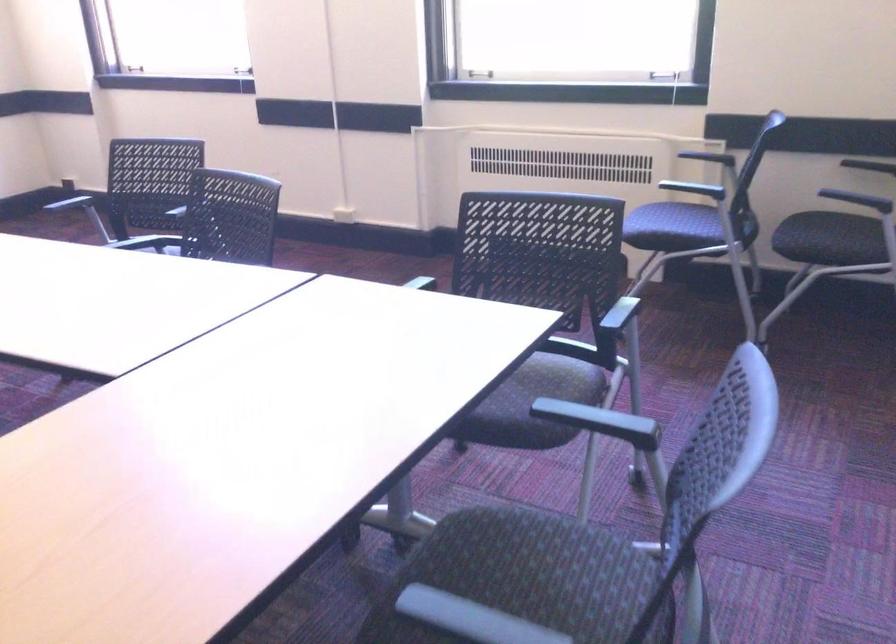
Find the location of `blue chair surface`. blue chair surface is located at coordinates (528, 404).